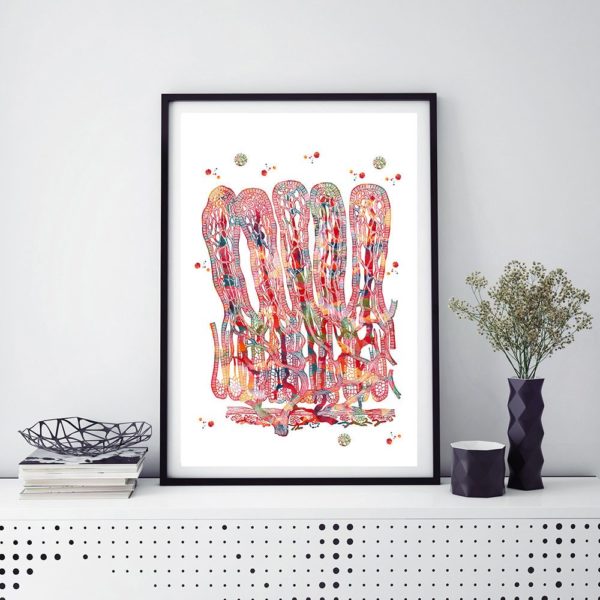
Image resolution: width=600 pixels, height=600 pixels. What are the coordinates of `art print` in the screenshot? It's located at (326, 322).